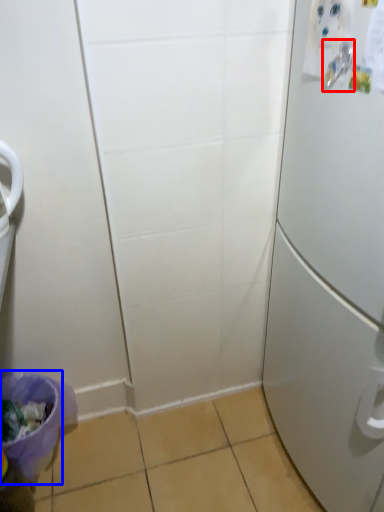
Question: Which object appears farthest to the camera in this image, door handle (highlighted by a red box) or potty (highlighted by a blue box)?

Choices:
 (A) door handle
 (B) potty

Answer: (B)